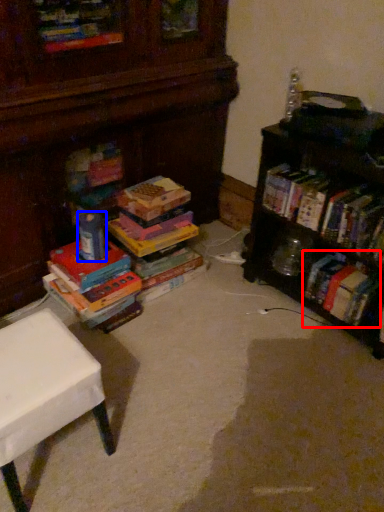
Question: Which point is closer to the camera, book (highlighted by a red box) or toy (highlighted by a blue box)?

Choices:
 (A) book
 (B) toy

Answer: (B)